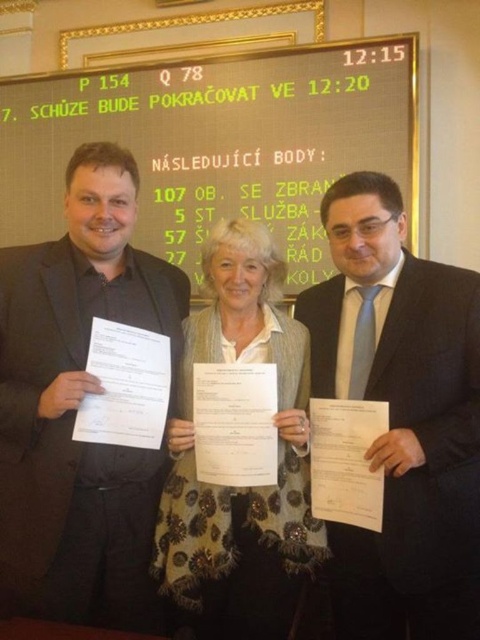
Question: Which of these objects is positioned farthest from the floral-patterned scarf at center?

Choices:
 (A) green digital display at upper center
 (B) black suit at center
 (C) dark suit at center

Answer: (A)

Question: Which object appears closest to the camera in this image?

Choices:
 (A) floral-patterned scarf at center
 (B) dark suit at center
 (C) green digital display at upper center
 (D) black suit at center

Answer: (B)

Question: Which object appears farthest from the camera in this image?

Choices:
 (A) black suit at center
 (B) green digital display at upper center
 (C) dark suit at center
 (D) floral-patterned scarf at center

Answer: (B)

Question: Is green digital display at upper center thinner than black suit at center?

Choices:
 (A) no
 (B) yes

Answer: (A)

Question: Does dark suit at center appear over floral-patterned scarf at center?

Choices:
 (A) yes
 (B) no

Answer: (A)

Question: Does green digital display at upper center appear on the left side of dark suit at center?

Choices:
 (A) yes
 (B) no

Answer: (A)